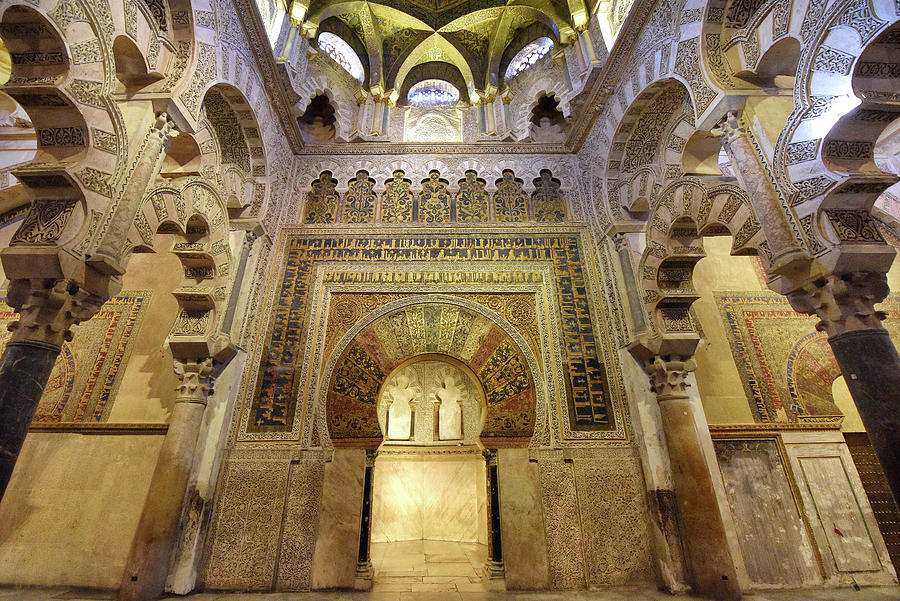
Locate an element on the screen. The height and width of the screenshot is (601, 900). archway is located at coordinates (198, 224), (39, 37), (676, 230), (883, 66).